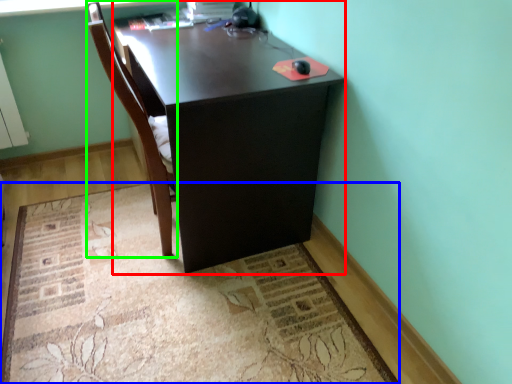
Question: Estimate the real-world distances between objects in this image. Which object is farther from desk (highlighted by a red box), mat (highlighted by a blue box) or chair (highlighted by a green box)?

Choices:
 (A) mat
 (B) chair

Answer: (A)